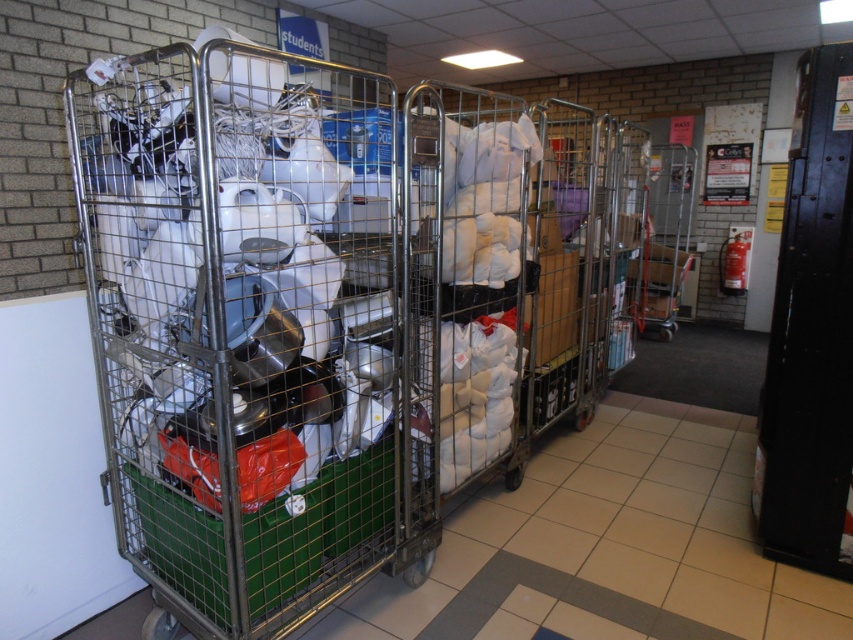
Question: Does metallic silver trolley at left appear over metallic silver trolley at center?

Choices:
 (A) yes
 (B) no

Answer: (B)

Question: Does metallic silver trolley at left appear on the right side of metallic silver trolley at center?

Choices:
 (A) yes
 (B) no

Answer: (B)

Question: Which point is closer to the camera?

Choices:
 (A) metallic silver trolley at center
 (B) metallic silver trolley at left

Answer: (B)

Question: Among these objects, which one is farthest from the camera?

Choices:
 (A) metallic silver trolley at center
 (B) metallic silver trolley at left

Answer: (A)

Question: Is metallic silver trolley at left thinner than metallic silver trolley at center?

Choices:
 (A) yes
 (B) no

Answer: (B)